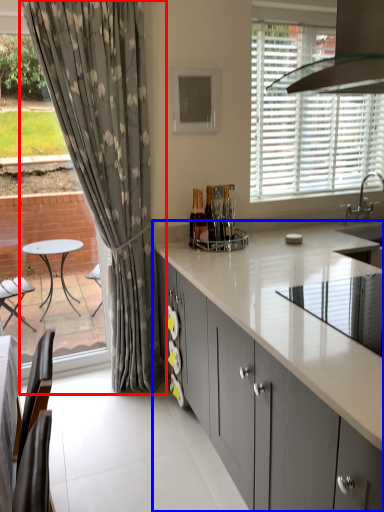
Question: Which of the following is the closest to the observer, curtain (highlighted by a red box) or cabinetry (highlighted by a blue box)?

Choices:
 (A) curtain
 (B) cabinetry

Answer: (B)